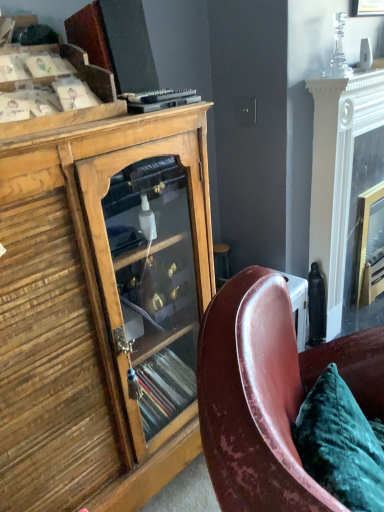
Question: From a real-world perspective, is white glossy fireplace at right located higher than wooden cabinet at upper left?

Choices:
 (A) no
 (B) yes

Answer: (A)

Question: Does white glossy fireplace at right appear on the left side of wooden cabinet at upper left?

Choices:
 (A) no
 (B) yes

Answer: (A)

Question: Considering the relative sizes of white glossy fireplace at right and wooden cabinet at upper left in the image provided, is white glossy fireplace at right wider than wooden cabinet at upper left?

Choices:
 (A) no
 (B) yes

Answer: (A)

Question: Is white glossy fireplace at right touching wooden cabinet at upper left?

Choices:
 (A) no
 (B) yes

Answer: (A)

Question: Does white glossy fireplace at right come behind wooden cabinet at upper left?

Choices:
 (A) no
 (B) yes

Answer: (B)

Question: Is white glossy fireplace at right bigger or smaller than wooden cabinet at left?

Choices:
 (A) small
 (B) big

Answer: (A)

Question: From a real-world perspective, is white glossy fireplace at right physically located above or below wooden cabinet at left?

Choices:
 (A) above
 (B) below

Answer: (B)

Question: Is white glossy fireplace at right in front of or behind wooden cabinet at left in the image?

Choices:
 (A) behind
 (B) front

Answer: (A)

Question: In terms of height, does white glossy fireplace at right look taller or shorter compared to wooden cabinet at left?

Choices:
 (A) short
 (B) tall

Answer: (A)

Question: Based on their sizes in the image, would you say leather at right is bigger or smaller than white glossy fireplace at right?

Choices:
 (A) small
 (B) big

Answer: (B)

Question: Looking at their shapes, would you say leather at right is wider or thinner than white glossy fireplace at right?

Choices:
 (A) thin
 (B) wide

Answer: (B)

Question: From a real-world perspective, relative to white glossy fireplace at right, is leather at right vertically above or below?

Choices:
 (A) below
 (B) above

Answer: (A)

Question: Based on their positions, is leather at right located to the left or right of white glossy fireplace at right?

Choices:
 (A) left
 (B) right

Answer: (A)

Question: In terms of size, does wooden cabinet at left appear bigger or smaller than black plastic remote control at upper center?

Choices:
 (A) small
 (B) big

Answer: (B)

Question: Is wooden cabinet at left taller or shorter than black plastic remote control at upper center?

Choices:
 (A) tall
 (B) short

Answer: (A)